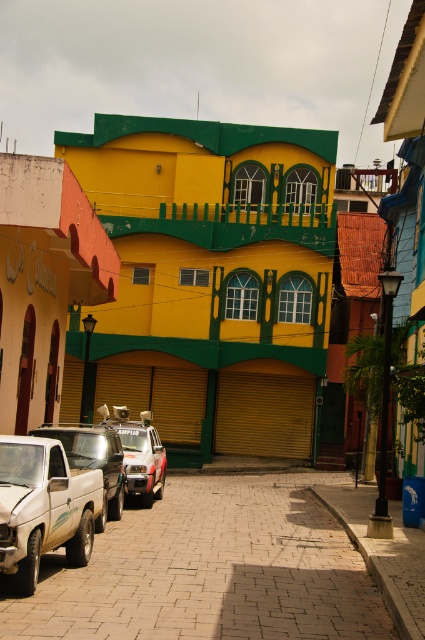
Question: Does white matte truck at lower left appear over white matte truck at left?

Choices:
 (A) no
 (B) yes

Answer: (B)

Question: Where is white matte truck at lower left located in relation to white matte car at center in the image?

Choices:
 (A) left
 (B) right

Answer: (B)

Question: Which of the following is the closest to the observer?

Choices:
 (A) white matte truck at lower left
 (B) white matte truck at left
 (C) white matte car at center

Answer: (A)

Question: Which point is farther from the camera taking this photo?

Choices:
 (A) (104, 442)
 (B) (51, 477)

Answer: (A)

Question: Which point is farther to the camera?

Choices:
 (A) (101, 500)
 (B) (135, 426)

Answer: (B)

Question: Can you confirm if white matte truck at lower left is positioned below white matte car at center?

Choices:
 (A) yes
 (B) no

Answer: (B)